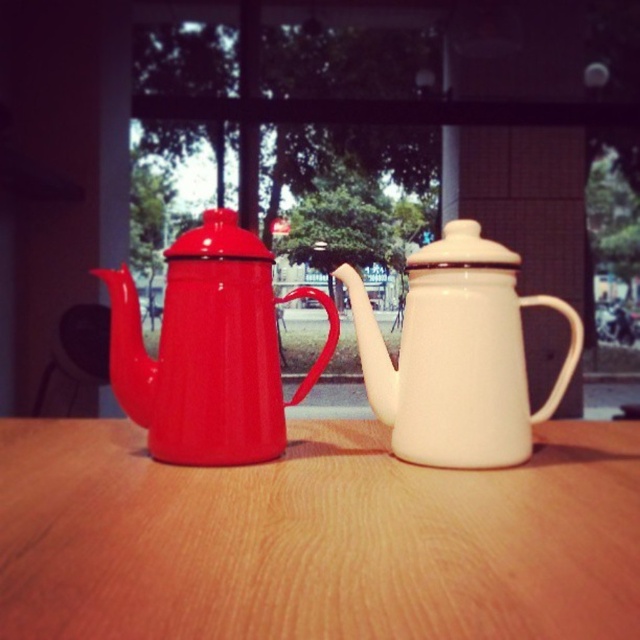
You are standing in front of the wooden table at center. A point is marked at coordinates (316, 538). Based on the scene description, where is this point located?

The point at coordinates (316, 538) corresponds to the wooden table at center.

Consider the image. You are a guest at a tea ceremony and need to place a tea cup on the wooden table at center. However, there is a matte enamel teapot at center in the way. From your perspective, which object should you move first to make space?

The wooden table at center is in front of the matte enamel teapot at center, meaning the teapot is behind the table. Since the table is already in front, you would need to move the matte enamel teapot at center to make space for placing the tea cup.

You are arranging teapots on a shelf and want to place the matte enamel teapot at center and the white glossy teapot at center in a way that follows the image. Which teapot should you place higher on the shelf?

The matte enamel teapot at center should be placed higher on the shelf since it is located above the white glossy teapot at center in the image.